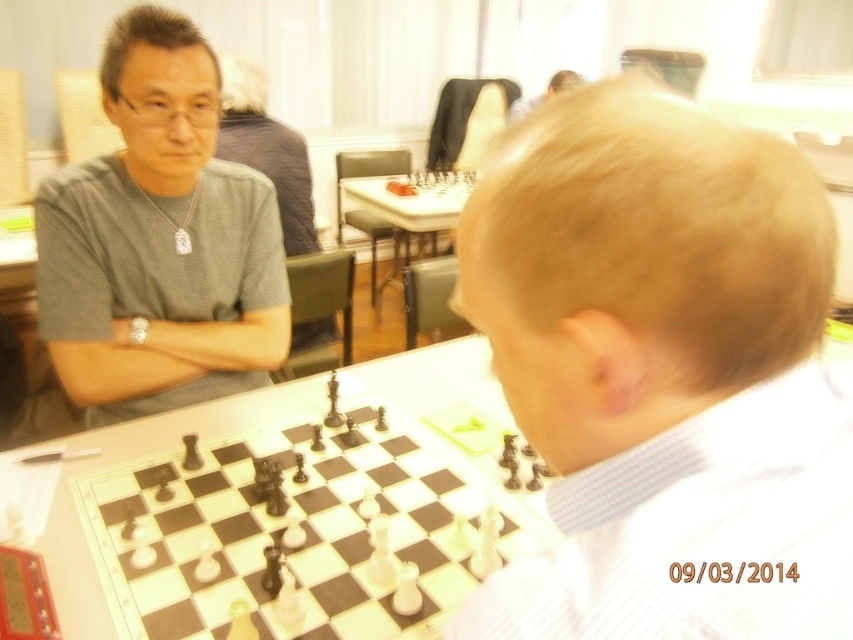
Based on the scene, which object is positioned lower in the image? The smooth blonde hair at center or the gray matte shirt at upper left?

The smooth blonde hair at center is positioned lower than the gray matte shirt at upper left.

You are a chess player who wants to place a new chess piece between the smooth blonde hair at center and the smooth skin head at upper center. Is there enough space to place it there?

The distance between the smooth blonde hair at center and the smooth skin head at upper center is 10.34 feet, so yes, there is enough space to place a new chess piece between them.